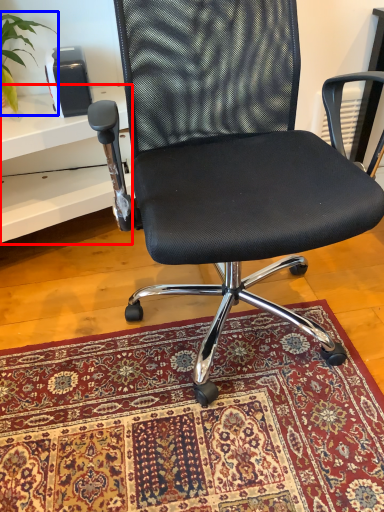
Question: Which object is further to the camera taking this photo, table (highlighted by a red box) or plant (highlighted by a blue box)?

Choices:
 (A) table
 (B) plant

Answer: (B)